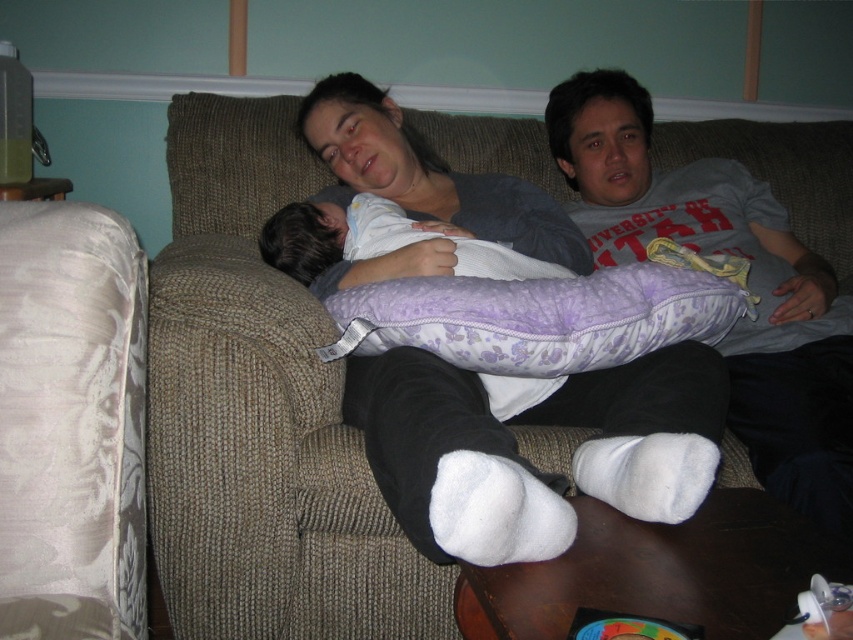
Is point (177, 380) more distant than point (798, 493)?

Yes, point (177, 380) is farther from viewer.

Is point (733, 468) positioned in front of point (718, 160)?

Yes, it is.

Is point (462, 170) positioned before point (585, 232)?

No.

You are a GUI agent. You are given a task and a screenshot of the screen. Output one action in this format:
    pyautogui.click(x=<x>, y=<y>)
    Task: Click on the brown textured couch at center
    Image resolution: width=853 pixels, height=640 pixels.
    Given the screenshot: What is the action you would take?
    pyautogui.click(x=260, y=413)